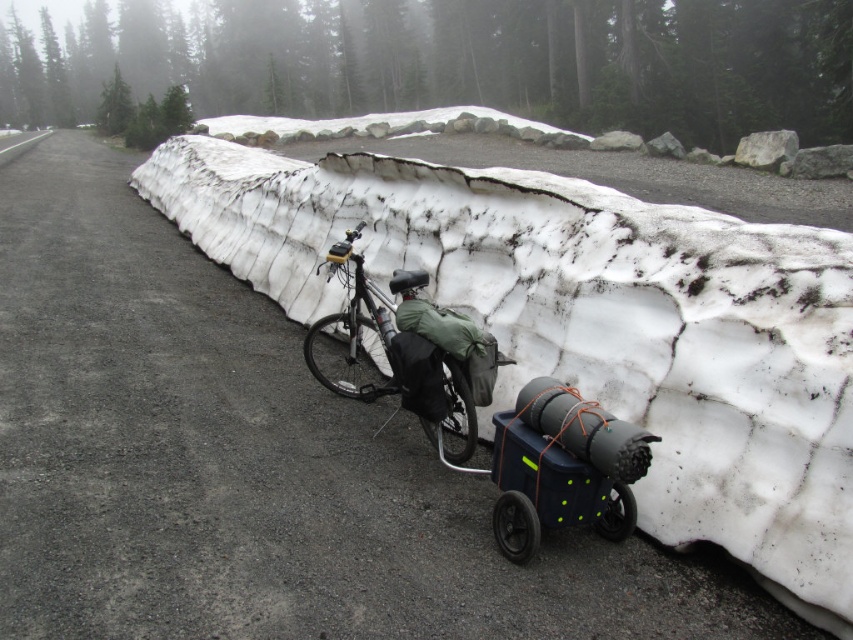
Question: Which of the following is the farthest from the observer?

Choices:
 (A) blue plastic cart at center
 (B) matte black bicycle at center

Answer: (B)

Question: Observing the image, what is the correct spatial positioning of blue plastic cart at center in reference to matte black bicycle at center?

Choices:
 (A) above
 (B) below

Answer: (B)

Question: Can you confirm if blue plastic cart at center is thinner than matte black bicycle at center?

Choices:
 (A) yes
 (B) no

Answer: (A)

Question: Which point appears closest to the camera in this image?

Choices:
 (A) (448, 371)
 (B) (630, 468)

Answer: (B)

Question: Is blue plastic cart at center behind matte black bicycle at center?

Choices:
 (A) yes
 (B) no

Answer: (B)